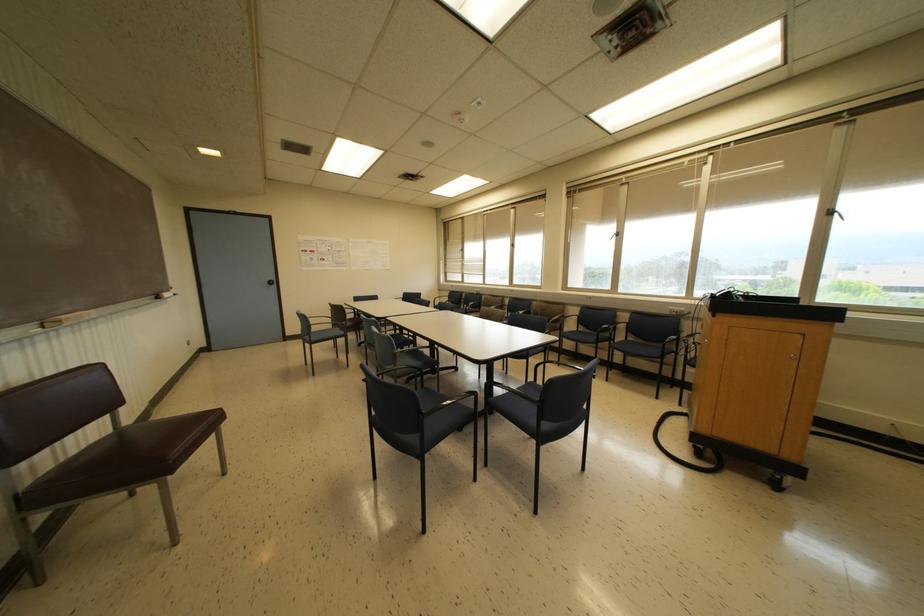
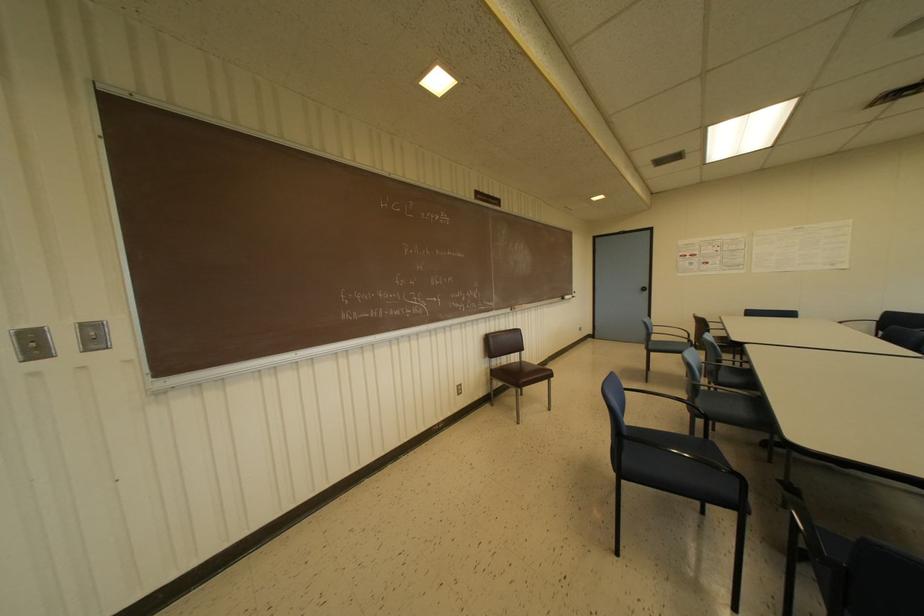
Locate, in the second image, the point that corresponds to (x=312, y=338) in the first image.

(650, 346)